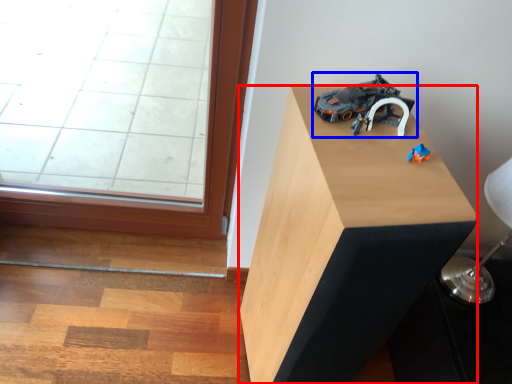
Question: Which object appears farthest to the camera in this image, furniture (highlighted by a red box) or toy (highlighted by a blue box)?

Choices:
 (A) furniture
 (B) toy

Answer: (B)